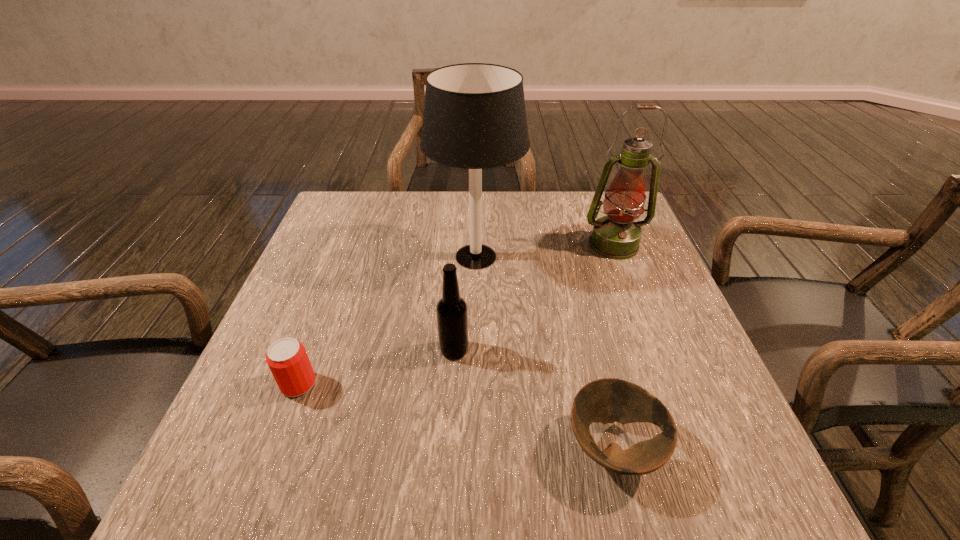
Where is `free point between the fourth tallest object and the third shortest object`? free point between the fourth tallest object and the third shortest object is located at coordinates (376, 367).

Locate an element on the screen. This screenshot has width=960, height=540. empty location between the third tallest object and the bowl is located at coordinates (534, 399).

The height and width of the screenshot is (540, 960). Find the location of `free space that is in between the oil lamp and the tallest object`. free space that is in between the oil lamp and the tallest object is located at coordinates (545, 251).

Find the location of a particular element. This screenshot has width=960, height=540. the closest object to the fourth farthest object is located at coordinates (452, 317).

I want to click on object that is the closest to the beer bottle, so click(x=474, y=118).

This screenshot has height=540, width=960. What are the coordinates of `free spot that satisfies the following two spatial constraints: 1. on the back side of the tallest object; 2. on the right side of the beer bottle` in the screenshot? It's located at (460, 256).

I want to click on vacant space that satisfies the following two spatial constraints: 1. on the back side of the oil lamp; 2. on the right side of the nearest object, so click(x=564, y=245).